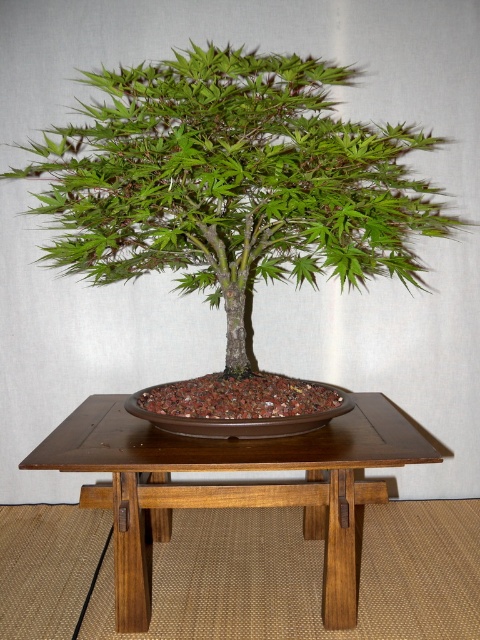
I want to click on green matte bonsai tree at center, so click(x=232, y=182).

Does point (285, 132) lie in front of point (157, 529)?

That is True.

The width and height of the screenshot is (480, 640). In order to click on green matte bonsai tree at center in this screenshot , I will do `click(232, 182)`.